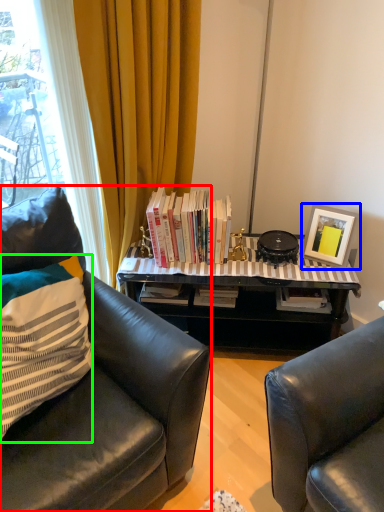
Question: Which is farther away from chair (highlighted by a red box)? picture frame (highlighted by a blue box) or pillow (highlighted by a green box)?

Choices:
 (A) picture frame
 (B) pillow

Answer: (A)